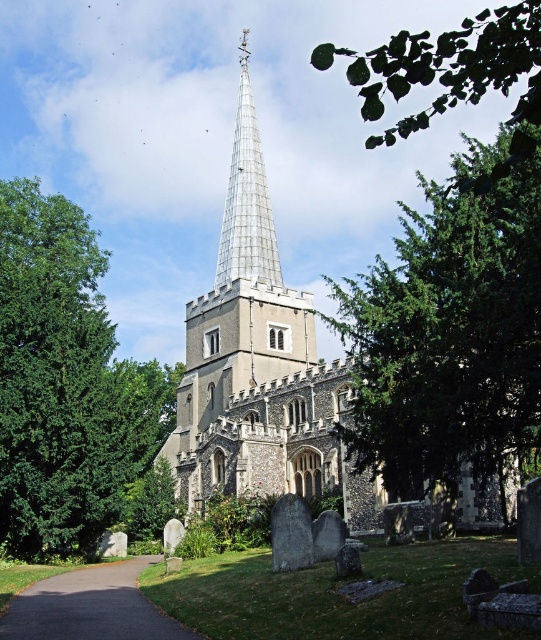
Can you confirm if green leafy tree at left is bigger than gray stone church steeple at center?

No, green leafy tree at left is not bigger than gray stone church steeple at center.

From the picture: Can you confirm if green leafy tree at left is positioned below gray stone church steeple at center?

Yes, green leafy tree at left is below gray stone church steeple at center.

Is point (8, 465) in front of point (273, 362)?

Yes, point (8, 465) is closer to viewer.

Find the location of a particular element. The height and width of the screenshot is (640, 541). green leafy tree at left is located at coordinates (65, 381).

Does green leafy tree at left appear over green leafy tree at lower center?

Yes.

Does point (151, 444) lie in front of point (127, 531)?

Yes.

Is point (90, 266) positioned in front of point (136, 532)?

No, it is behind (136, 532).

In order to click on green leafy tree at left in this screenshot , I will do `click(65, 381)`.

Does gray stone church steeple at center have a smaller size compared to brown gravel path at lower left?

Actually, gray stone church steeple at center might be larger than brown gravel path at lower left.

Where is `gray stone church steeple at center`? This screenshot has width=541, height=640. gray stone church steeple at center is located at coordinates (260, 365).

You are a GUI agent. You are given a task and a screenshot of the screen. Output one action in this format:
    pyautogui.click(x=<x>, y=<y>)
    Task: Click on the gray stone church steeple at center
    Image resolution: width=541 pixels, height=640 pixels.
    Given the screenshot: What is the action you would take?
    pyautogui.click(x=260, y=365)